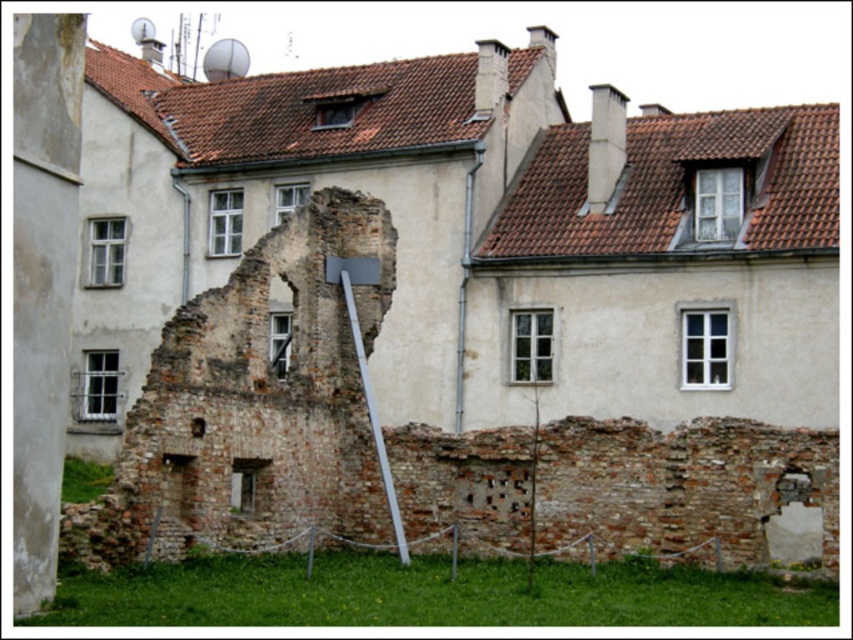
Is brick wall at center further to camera compared to white metallic pole at center?

No.

Can you confirm if brick wall at center is smaller than white metallic pole at center?

No.

Who is more distant from viewer, (299, 381) or (349, 276)?

The point (349, 276) is more distant.

Locate an element on the screen. This screenshot has height=640, width=853. brick wall at center is located at coordinates (408, 440).